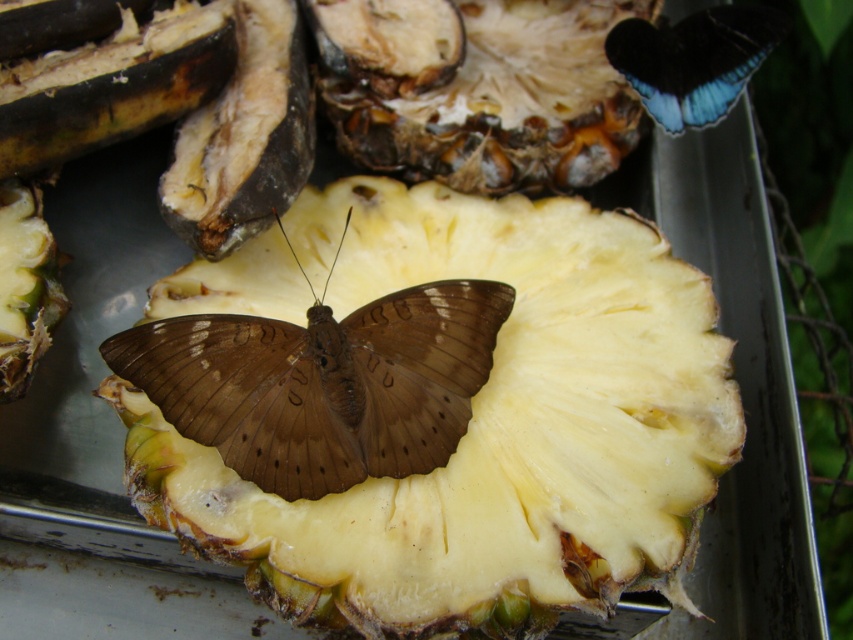
You are an entomologist observing two butterflies on a pineapple slice. You see a brown matte butterfly at center and a blue glossy butterfly at upper right. Which butterfly is positioned to the right side of the other?

The blue glossy butterfly at upper right is positioned to the right of the brown matte butterfly at center.

Based on the coordinates provided in the scene description, where is the brown matte butterfly at center located?

The brown matte butterfly at center is located at point (x=322, y=384).

Looking at this image, you are a chef preparing a fruit platter and notice the yellowish matte pineapple at center and the brown matte butterfly at center. Which object would you need to remove first to ensure the fruit platter is clean and safe for consumption?

The brown matte butterfly at center must be removed first because it is an insect and not safe for consumption, while the yellowish matte pineapple at center is the fruit itself and should remain on the platter.